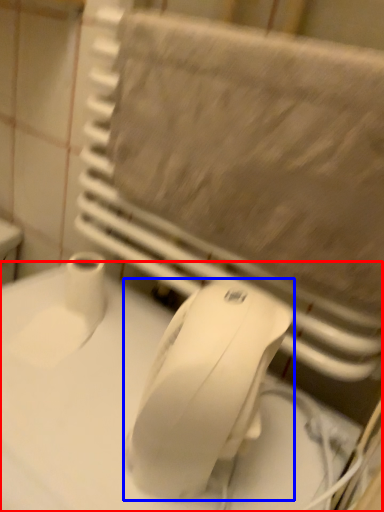
Question: Among these objects, which one is nearest to the camera, counter top (highlighted by a red box) or mouse (highlighted by a blue box)?

Choices:
 (A) counter top
 (B) mouse

Answer: (A)